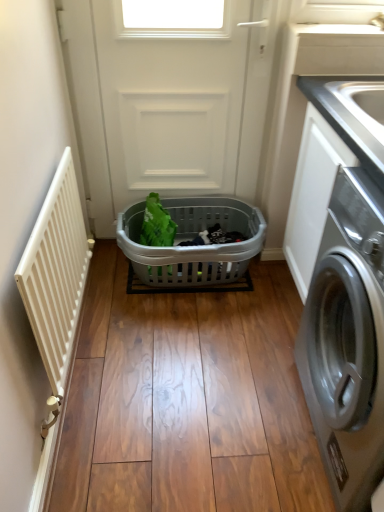
Question: From a real-world perspective, relative to white matte screen door at center, is white matte radiator at left vertically above or below?

Choices:
 (A) below
 (B) above

Answer: (A)

Question: Considering the positions of point (59, 234) and point (127, 72), is point (59, 234) closer or farther from the camera than point (127, 72)?

Choices:
 (A) closer
 (B) farther

Answer: (A)

Question: Considering the real-world distances, which object is farthest from the white matte screen door at center?

Choices:
 (A) white matte radiator at left
 (B) white glossy countertop at upper right
 (C) silver metallic washing machine at right
 (D) gray plastic basket at center

Answer: (C)

Question: Which of these objects is positioned farthest from the white glossy countertop at upper right?

Choices:
 (A) silver metallic washing machine at right
 (B) gray plastic basket at center
 (C) white matte screen door at center
 (D) white matte radiator at left

Answer: (D)